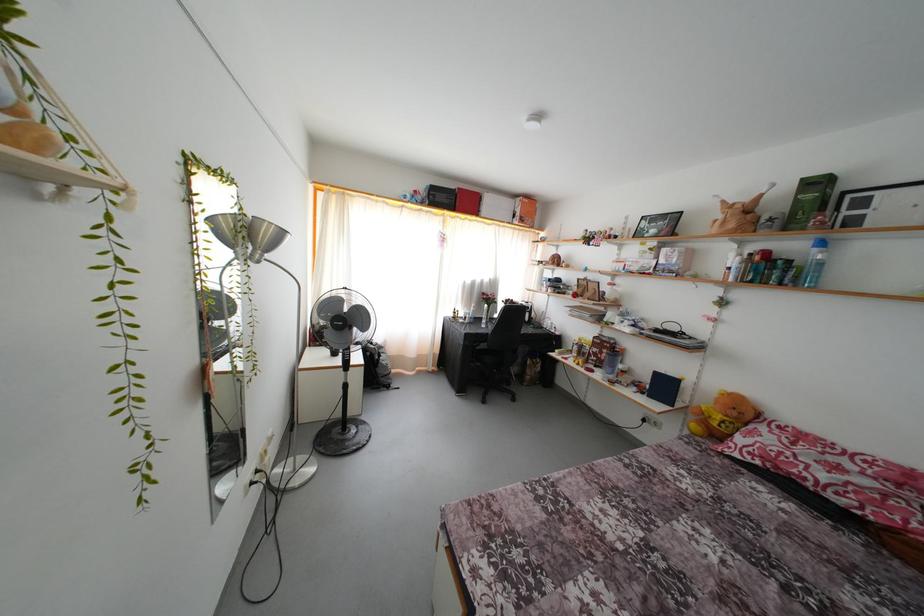
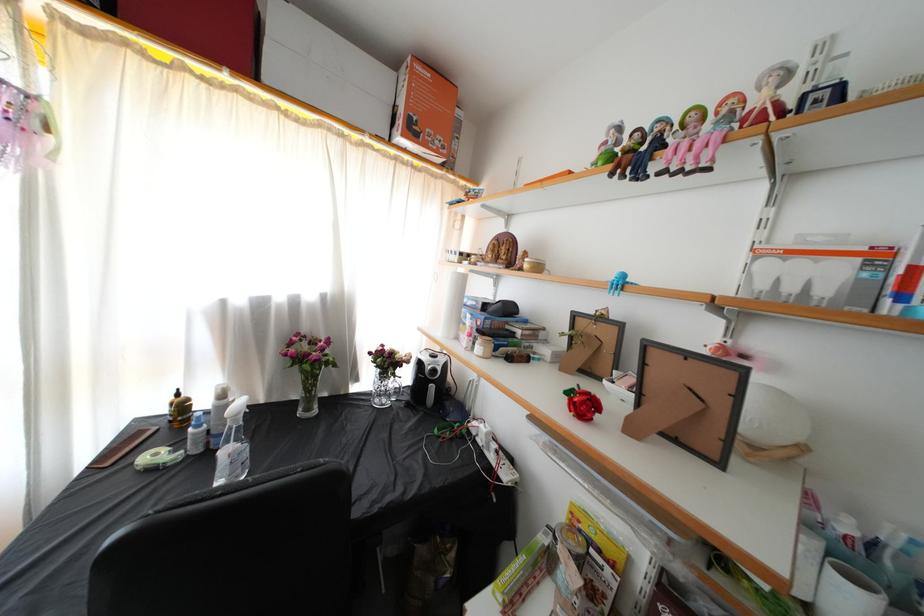
The images are taken continuously from a first-person perspective. In which direction are you moving?

The movement direction of the cameraman is right, forward.